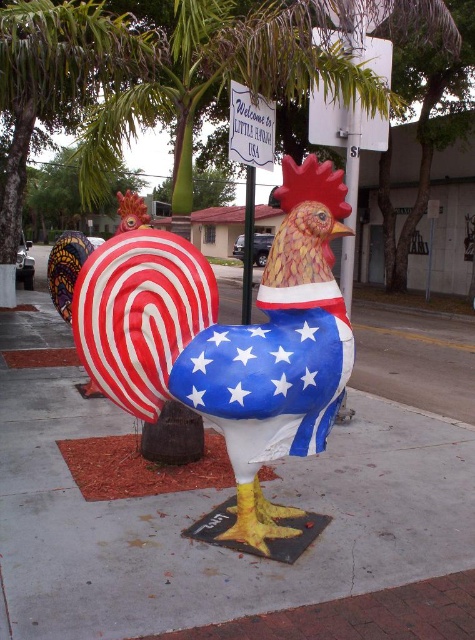
Can you confirm if painted fabric rooster at center is bigger than white plastic sign at upper center?

Yes, painted fabric rooster at center is bigger than white plastic sign at upper center.

Can you confirm if painted fabric rooster at center is positioned to the left of white plastic sign at upper center?

Correct, you'll find painted fabric rooster at center to the left of white plastic sign at upper center.

What do you see at coordinates (229, 339) in the screenshot? I see `painted fabric rooster at center` at bounding box center [229, 339].

Identify the location of painted fabric rooster at center. (229, 339).

Can you confirm if painted fabric rooster at center is positioned to the right of metallic pole at center?

Yes, painted fabric rooster at center is to the right of metallic pole at center.

Does painted fabric rooster at center have a greater height compared to metallic pole at center?

No.

Who is more distant from viewer, (301, 275) or (246, 220)?

The point (246, 220) is more distant.

I want to click on painted fabric rooster at center, so click(x=229, y=339).

Does painted concrete sidewalk at center have a lesser height compared to white plastic sign at upper center?

Incorrect, painted concrete sidewalk at center's height does not fall short of white plastic sign at upper center's.

Who is more distant from viewer, (370, 467) or (321, 40)?

The point (321, 40) is more distant.

Between point (62, 627) and point (362, 60), which one is positioned behind?

Positioned behind is point (362, 60).

The height and width of the screenshot is (640, 475). I want to click on painted concrete sidewalk at center, so click(x=218, y=500).